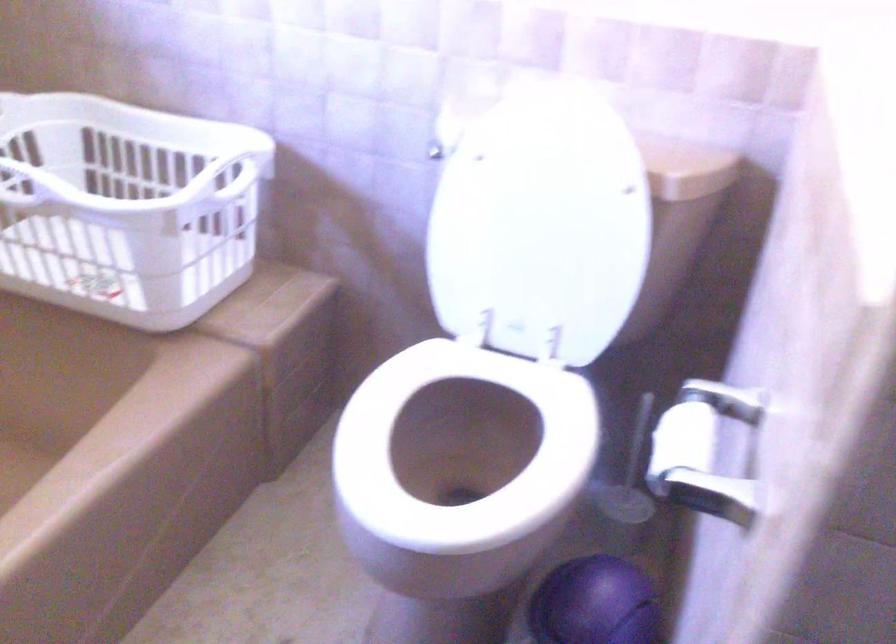
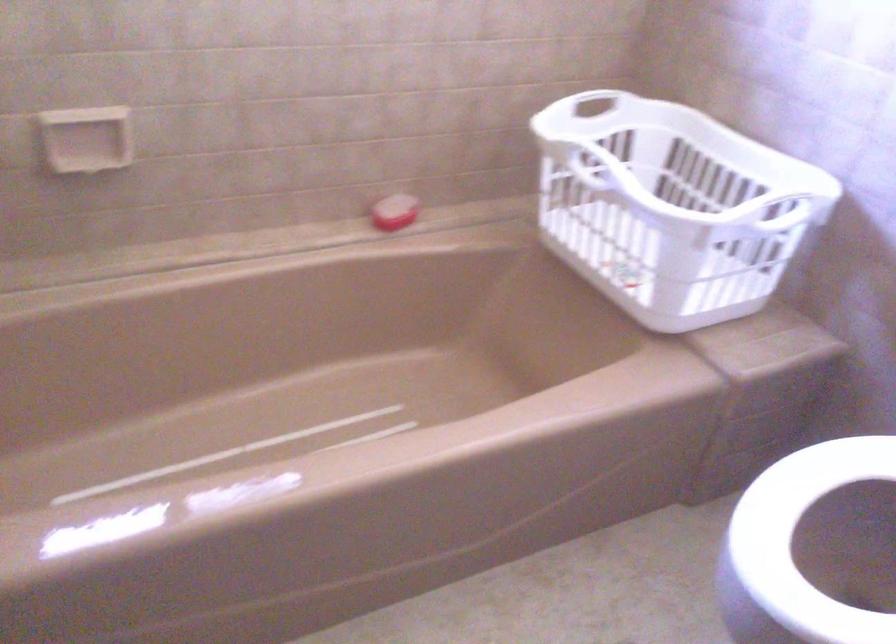
Find the pixel in the second image that matches [231,175] in the first image.

(780, 207)